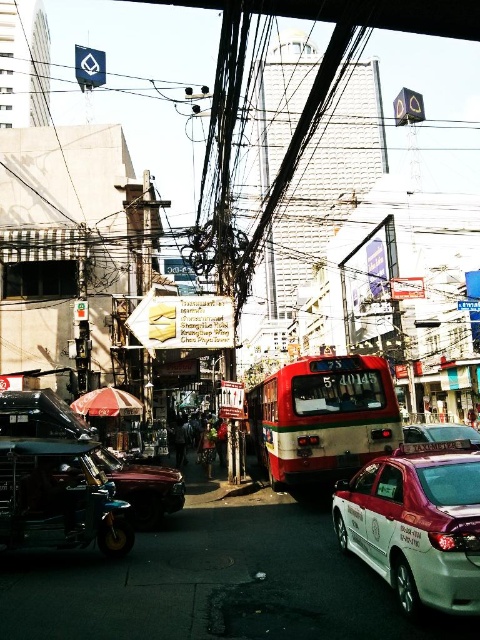
You are a delivery rider who needs to park your scooter. You see a metallic silver scooter at lower left and a metallic red scooter at lower left. Which scooter is blocking the other one?

The metallic silver scooter at lower left is positioned under the metallic red scooter at lower left, so the metallic red scooter at lower left is blocking the metallic silver scooter at lower left.

You are a delivery person who needs to load a tall package into your van. You see the white metallic taxi at center and the red matte bus at center in the street. Which vehicle is shorter and better suited for loading a tall package?

The white metallic taxi at center is not as tall as the red matte bus at center, so the white metallic taxi at center is shorter and better suited for loading a tall package.

You are a delivery person needing to choose between the metallic silver scooter at lower left and the metallic silver taxi at center for a short trip. Which vehicle would you choose if you want something more compact to navigate narrow alleys?

The metallic silver scooter at lower left is smaller than the metallic silver taxi at center, so it would be more compact and easier to navigate narrow alleys.